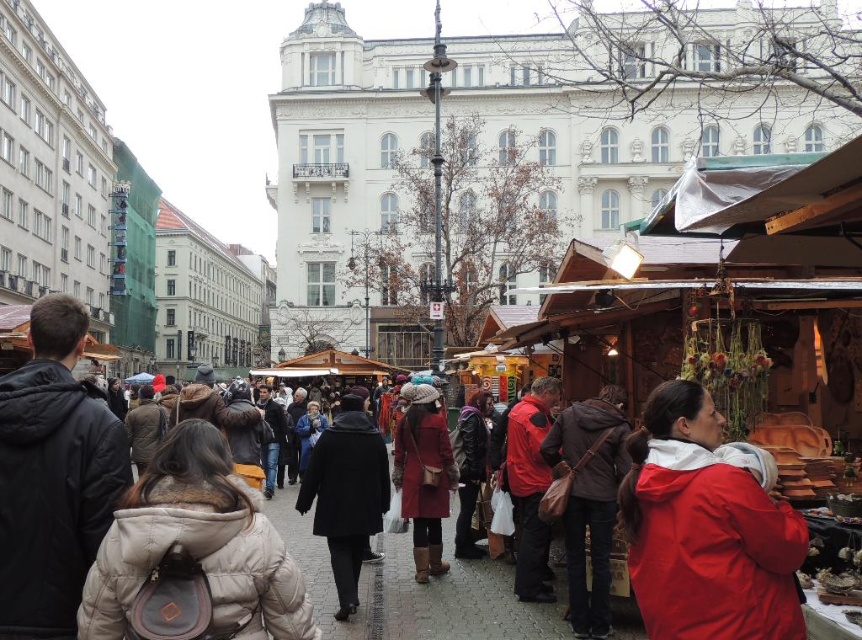
You are standing at the market and want to take a photo of the point at coordinates (97, 410). Your camera has a maximum focus range of 50 meters. Will the camera be able to focus on that point?

The distance of point (97, 410) from the camera is 58.69 meters, which exceeds the camera maximum focus range of 50 meters. The camera will not be able to focus on that point.

You are a customer at the market and want to see the items behind the dark gray jacket at left and the brown leather jacket at center. Which jacket do you need to ask to move first?

The dark gray jacket at left is in front of the brown leather jacket at center, so you need to ask the person wearing the dark gray jacket at left to move first to see what is behind both jackets.